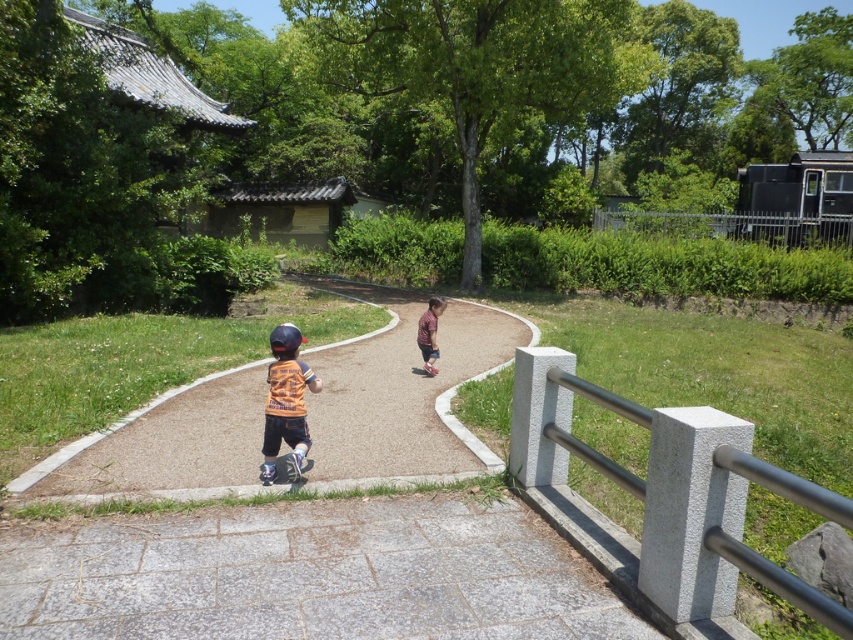
You are a parent supervising your children playing in the park. You see the black rubber skateboard at center and the matte black helmet at center. Which object is positioned lower from the ground?

The black rubber skateboard at center is below the matte black helmet at center, so the skateboard is positioned lower from the ground.

You are a parent supervising your children playing in the park. You see the black rubber skateboard at center and the matte black helmet at center. Which object is wider?

The black rubber skateboard at center is wider than the matte black helmet at center.